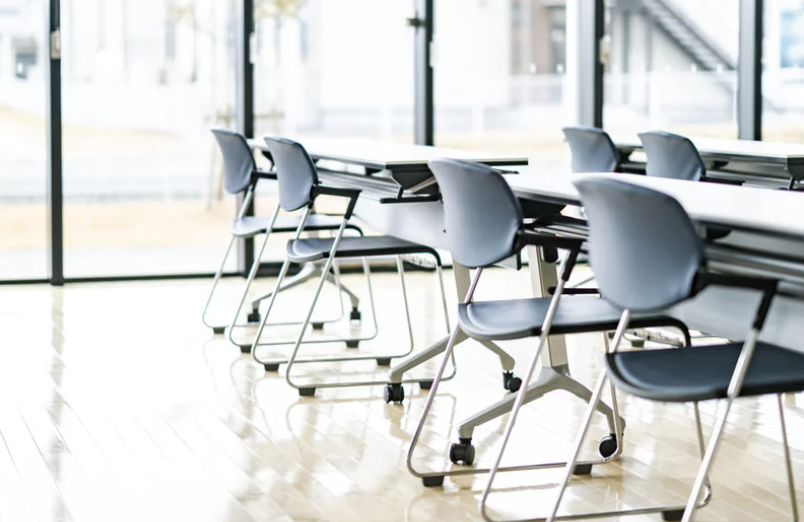
This screenshot has width=804, height=522. What are the coordinates of `chair backs` in the screenshot? It's located at (236, 170), (289, 183), (466, 224), (641, 251), (591, 136), (671, 165).